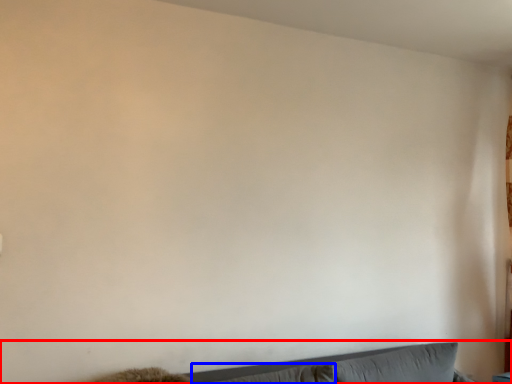
Question: Which of the following is the farthest to the observer, couch (highlighted by a red box) or pillow (highlighted by a blue box)?

Choices:
 (A) couch
 (B) pillow

Answer: (B)